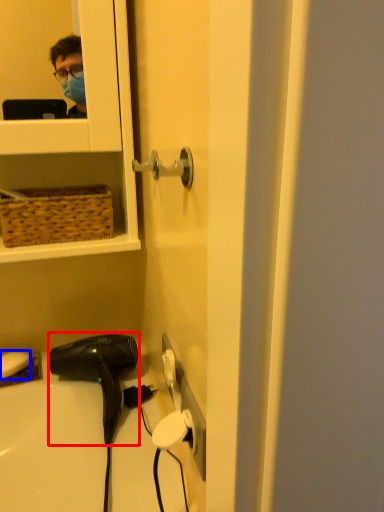
Question: Which object is further to the camera taking this photo, hair drier (highlighted by a red box) or soap (highlighted by a blue box)?

Choices:
 (A) hair drier
 (B) soap

Answer: (B)